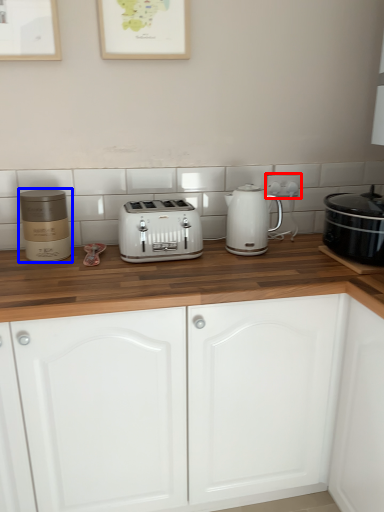
Question: Which of the following is the closest to the observer, electric outlet (highlighted by a red box) or appliance (highlighted by a blue box)?

Choices:
 (A) electric outlet
 (B) appliance

Answer: (B)